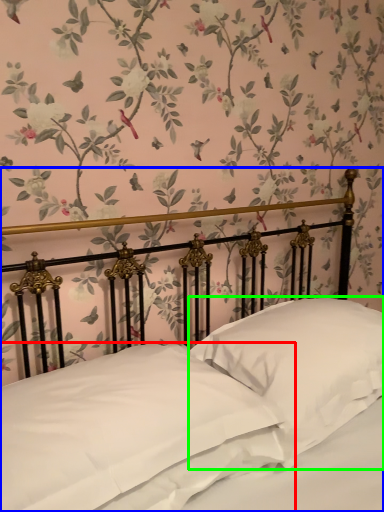
Question: Based on their relative distances, which object is nearer to pillow (highlighted by a red box)? Choose from bed (highlighted by a blue box) and pillow (highlighted by a green box).

Choices:
 (A) bed
 (B) pillow

Answer: (A)